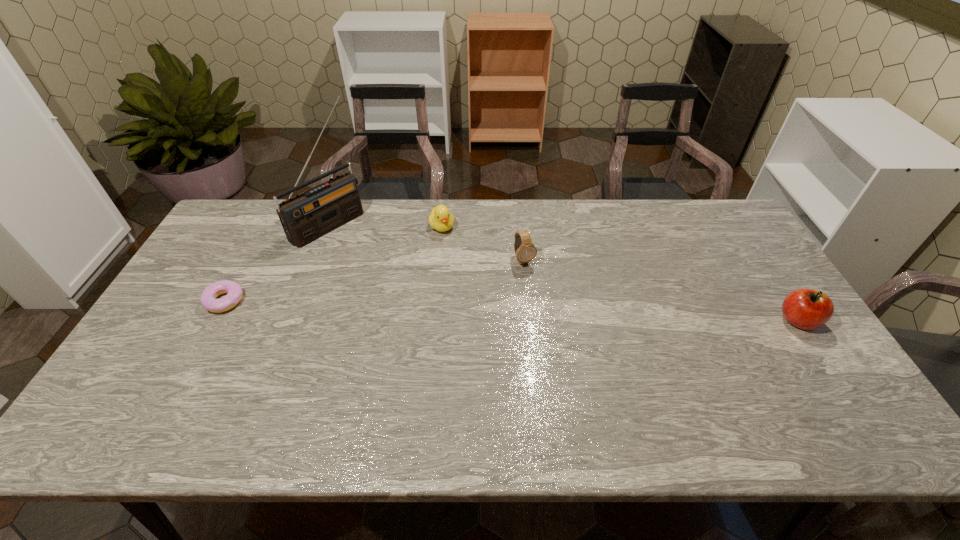
Point out which object is positioned as the fourth nearest to the rightmost object. Please provide its 2D coordinates. Your answer should be formatted as a tuple, i.e. [(x, y)], where the tuple contains the x and y coordinates of a point satisfying the conditions above.

[(208, 299)]

Where is `vacant space that satisfies the following two spatial constraints: 1. on the back side of the leftmost object; 2. on the right side of the third object from left to right`? This screenshot has height=540, width=960. vacant space that satisfies the following two spatial constraints: 1. on the back side of the leftmost object; 2. on the right side of the third object from left to right is located at coordinates (265, 227).